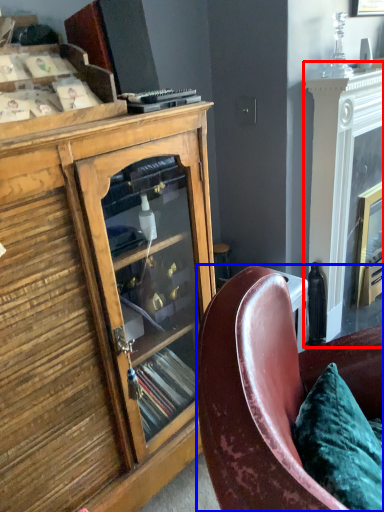
Question: Which point is closer to the camera, fireplace (highlighted by a red box) or chair (highlighted by a blue box)?

Choices:
 (A) fireplace
 (B) chair

Answer: (B)